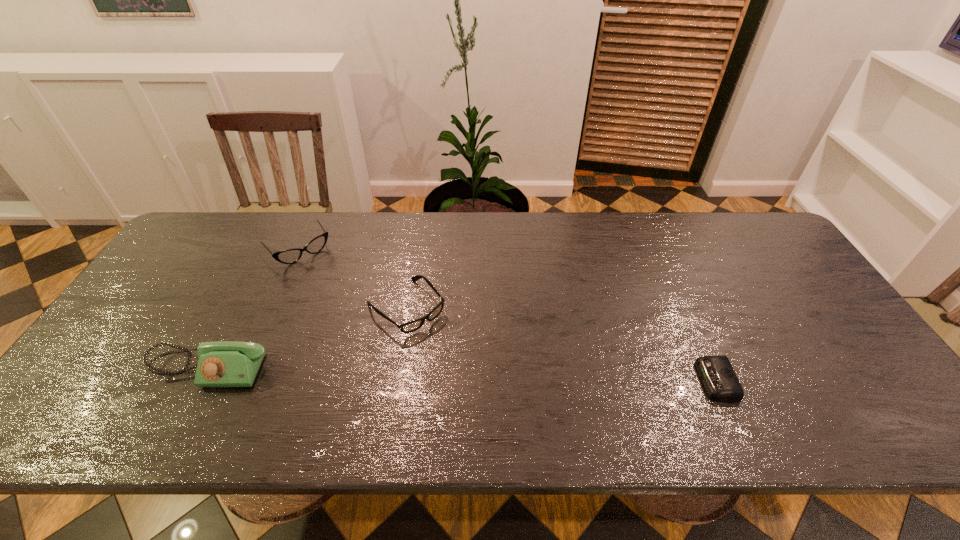
Find the location of `vacant space located 0.070m on the front-facing side of the second object from right to left`. vacant space located 0.070m on the front-facing side of the second object from right to left is located at coordinates (445, 348).

Identify the location of vacant space situated 0.210m on the front-facing side of the second object from right to left. [482, 384].

You are a GUI agent. You are given a task and a screenshot of the screen. Output one action in this format:
    pyautogui.click(x=<x>, y=<y>)
    Task: Click on the vacant space located on the front-facing side of the second object from right to left
    
    Given the screenshot: What is the action you would take?
    pyautogui.click(x=473, y=376)

At what (x,y) coordinates should I click in order to perform the action: click on free region located 0.210m on the front-facing side of the taller spectacles. Please return your answer as a coordinate pair (x, y). The width and height of the screenshot is (960, 540). Looking at the image, I should click on (x=345, y=306).

Where is `free point located on the front-facing side of the taller spectacles`? This screenshot has height=540, width=960. free point located on the front-facing side of the taller spectacles is located at coordinates (325, 282).

The width and height of the screenshot is (960, 540). Find the location of `vacant space located on the front-facing side of the taller spectacles`. vacant space located on the front-facing side of the taller spectacles is located at coordinates (364, 330).

Locate an element on the screen. object at the far edge is located at coordinates (289, 256).

Locate an element on the screen. This screenshot has width=960, height=540. telephone present at the near edge is located at coordinates (224, 363).

Locate an element on the screen. This screenshot has height=540, width=960. alarm clock that is at the near edge is located at coordinates (716, 372).

At what (x,y) coordinates should I click in order to perform the action: click on object present at the left edge. Please return your answer as a coordinate pair (x, y). This screenshot has width=960, height=540. Looking at the image, I should click on (224, 363).